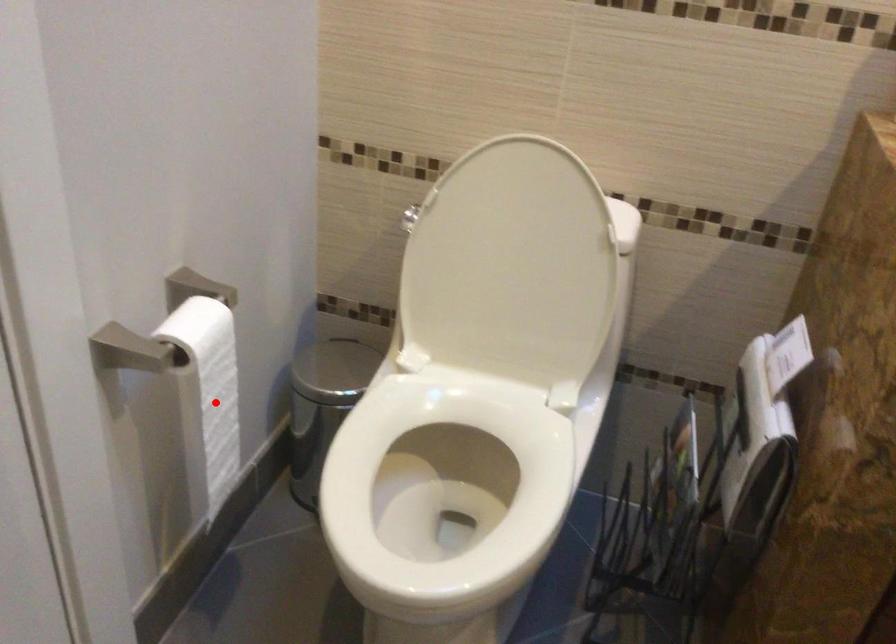
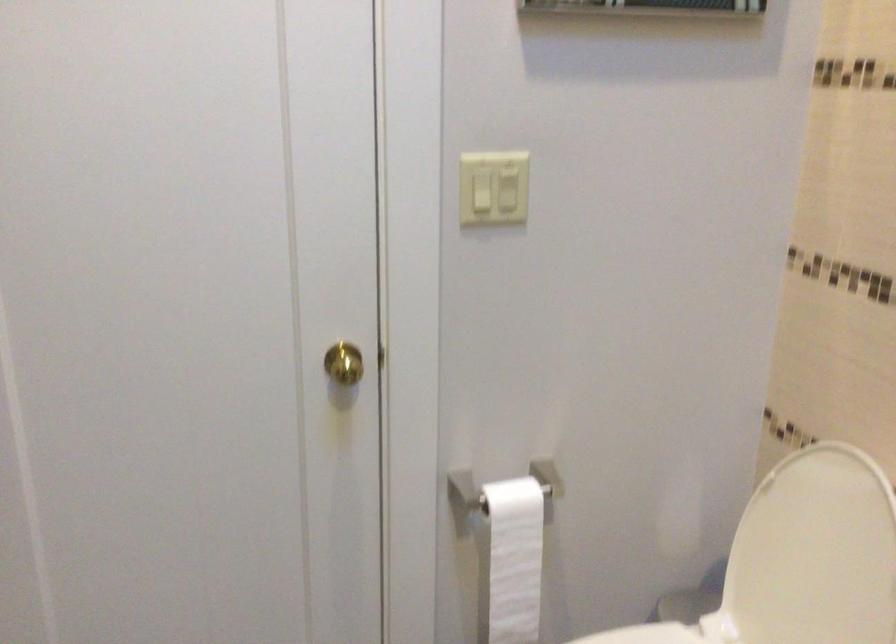
Question: I am providing you with two images of the same scene from different viewpoints. Given a red point in image1, look at the same physical point in image2. Is it:

Choices:
 (A) Closer to the viewpoint
 (B) Farther from the viewpoint

Answer: (B)